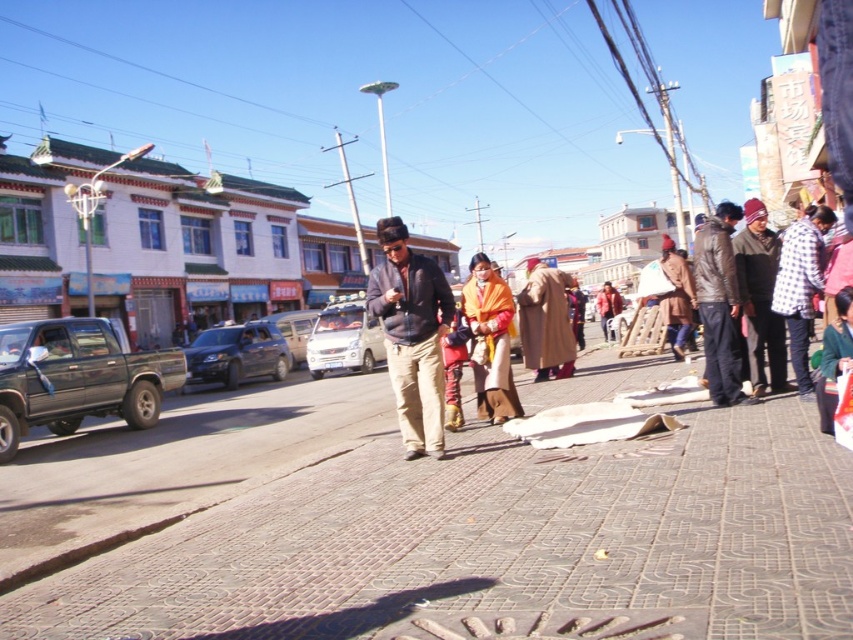
You are a delivery person who needs to park your vehicle between the dark green matte truck at left and the metallic silver car at center. Is there enough space for your vehicle which is 2 meters long?

The dark green matte truck at left is positioned on the right side of metallic silver car at center, so there is no space between them for your vehicle to park. You will need to look for another parking spot.

You are a delivery person who needs to place a package on the ground between the brown textured pavement at center and the metallic silver car at center. Which object should you place the package closer to so that it doesn not get run over by the car?

You should place the package closer to the brown textured pavement at center because it is shorter than the metallic silver car at center, so the car might not notice the package if it is near the pavement.